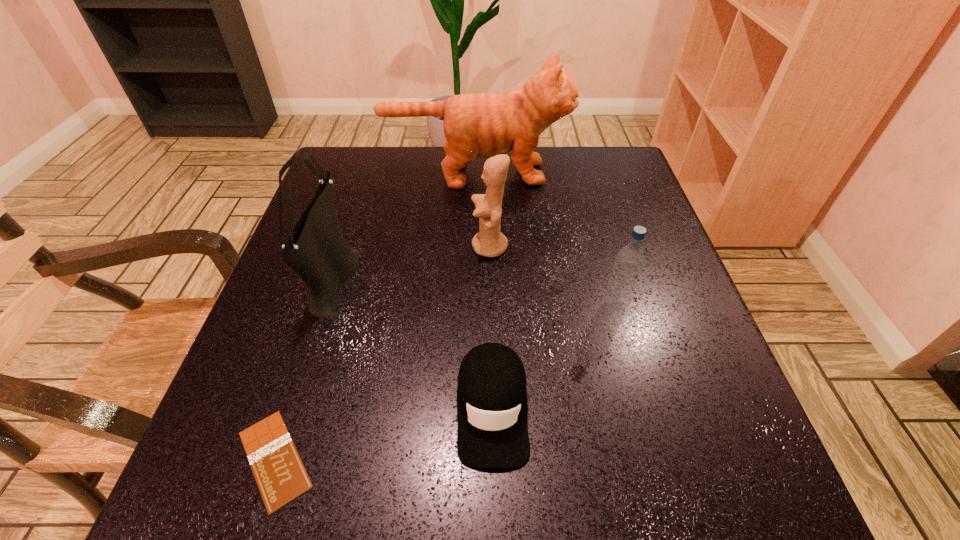
At what (x,y) coordinates should I click in order to perform the action: click on blank space located on the front-facing side of the figurine. Please return your answer as a coordinate pair (x, y). Image resolution: width=960 pixels, height=540 pixels. Looking at the image, I should click on (407, 247).

The width and height of the screenshot is (960, 540). Find the location of `vacant region located 0.370m on the front-facing side of the figurine`. vacant region located 0.370m on the front-facing side of the figurine is located at coordinates (300, 247).

This screenshot has height=540, width=960. I want to click on vacant space located 0.240m on the left of the water bottle, so click(475, 306).

You are a GUI agent. You are given a task and a screenshot of the screen. Output one action in this format:
    pyautogui.click(x=<x>, y=<y>)
    Task: Click on the vacant area situated on the back of the shortest object
    The height and width of the screenshot is (540, 960).
    Given the screenshot: What is the action you would take?
    pyautogui.click(x=324, y=308)

The width and height of the screenshot is (960, 540). I want to click on object located in the far edge section of the desktop, so click(483, 125).

This screenshot has width=960, height=540. Identify the location of cap that is positioned at the near edge. (492, 432).

Image resolution: width=960 pixels, height=540 pixels. Find the location of `chocolate bar present at the near edge`. chocolate bar present at the near edge is located at coordinates (281, 477).

The width and height of the screenshot is (960, 540). In order to click on cat located at the left edge in this screenshot , I will do `click(483, 125)`.

Find the location of `shoulder bag that is at the left edge`. shoulder bag that is at the left edge is located at coordinates [x=316, y=250].

Identify the location of chocolate bar at the left edge. The height and width of the screenshot is (540, 960). (281, 477).